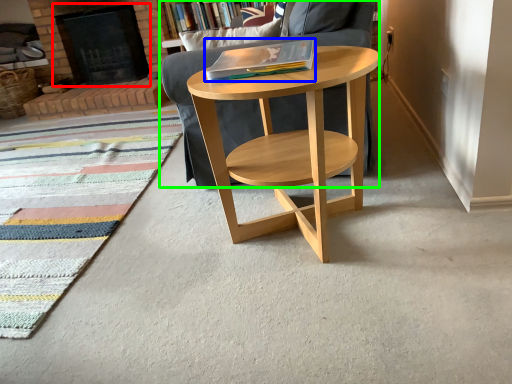
Question: Based on their relative distances, which object is nearer to fireplace (highlighted by a red box)? Choose from book (highlighted by a blue box) and chair (highlighted by a green box).

Choices:
 (A) book
 (B) chair

Answer: (B)